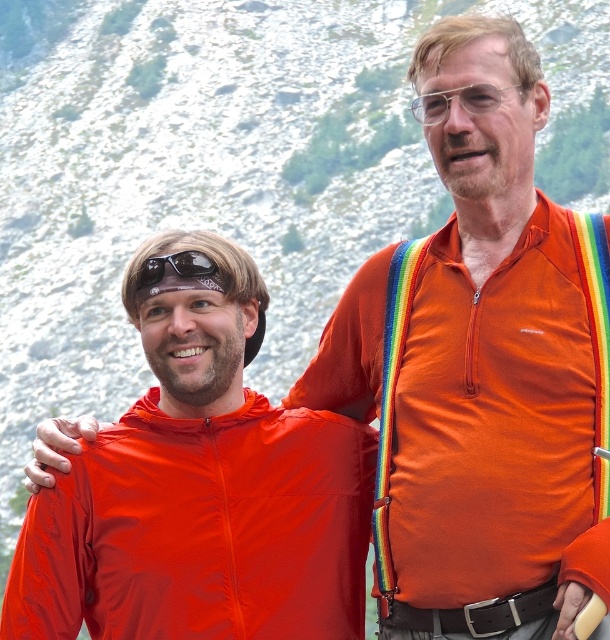
You are a photographer positioned at the center of the scene. You want to capture a photo that includes both the matte nylon jacket at left and the black rubber sunglasses at upper left. What is the minimum distance you need to move backward to ensure both objects are in frame?

The matte nylon jacket at left and black rubber sunglasses at upper left are 6.94 meters apart. To include both in the frame, you need to move backward until your camera can capture a field of view that accommodates this distance. The exact distance depends on your camera lens, but generally, increasing the distance from the subjects widens the field of view, allowing both objects to be included.

You are an outdoor photographer planning to capture a group photo of the two people in the image. The orange fabric jacket at center and the matte nylon jacket at left are part of the group. You want to ensure that both jackets are clearly visible in the photo. Considering their sizes, which jacket might require more space in the frame to ensure visibility?

The orange fabric jacket at center is bigger than the matte nylon jacket at left, so it might require more space in the frame to ensure visibility.